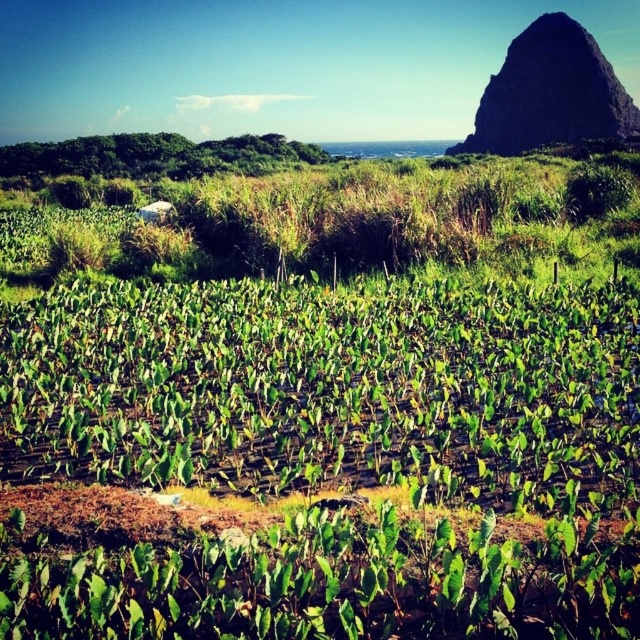
Locate an element on the screen. The width and height of the screenshot is (640, 640). green leafy plants at center is located at coordinates (324, 387).

Does point (307, 477) come in front of point (592, 51)?

Yes.

Is point (294, 323) in front of point (541, 125)?

Yes, point (294, 323) is closer to viewer.

I want to click on green leafy plants at center, so click(x=324, y=387).